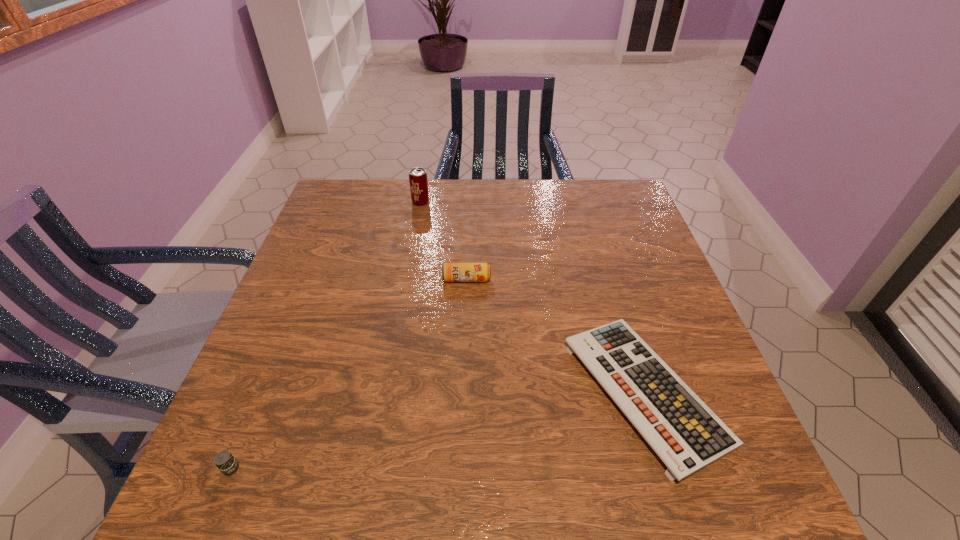
In the image, there is a desktop. At what (x,y) coordinates should I click in order to perform the action: click on vacant space at the near edge. Please return your answer as a coordinate pair (x, y). Looking at the image, I should click on (363, 481).

I want to click on vacant area at the left edge, so click(346, 233).

Locate an element on the screen. free spot at the right edge of the desktop is located at coordinates (663, 319).

Find the location of a particular element. blank space at the far left corner is located at coordinates (353, 207).

You are a GUI agent. You are given a task and a screenshot of the screen. Output one action in this format:
    pyautogui.click(x=<x>, y=<y>)
    Task: Click on the free space at the near left corner of the desktop
    This screenshot has width=960, height=540.
    Given the screenshot: What is the action you would take?
    pyautogui.click(x=265, y=494)

Find the location of a particular element. This screenshot has width=960, height=540. vacant space at the far right corner is located at coordinates (598, 193).

Where is `free space between the tallest object and the computer keyboard`? This screenshot has height=540, width=960. free space between the tallest object and the computer keyboard is located at coordinates (533, 297).

The height and width of the screenshot is (540, 960). What are the coordinates of `free space between the rightmost beer can and the leftmost beer can` in the screenshot? It's located at (348, 374).

Identify the location of unoccupied position between the leftmost object and the shortest object. The image size is (960, 540). (438, 430).

Where is `vacant space in between the leftmost object and the rightmost beer can`? Image resolution: width=960 pixels, height=540 pixels. vacant space in between the leftmost object and the rightmost beer can is located at coordinates (x=348, y=374).